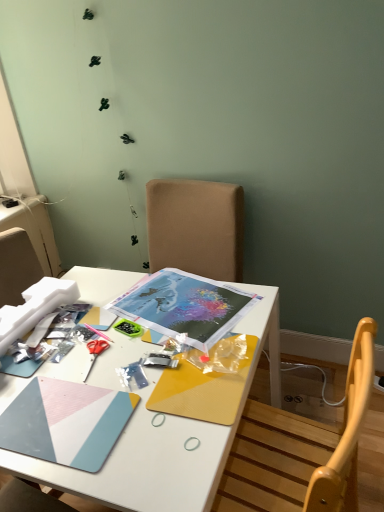
Where is `vacant space behind red plastic scissors at center-left`? vacant space behind red plastic scissors at center-left is located at coordinates (106, 318).